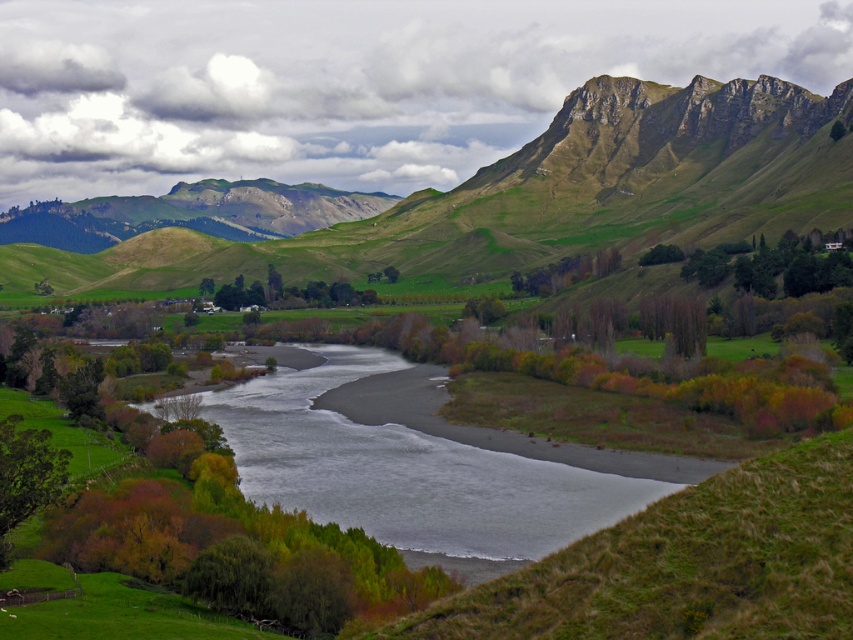
Is gray sand river at center above green leafy tree at center?

Correct, gray sand river at center is located above green leafy tree at center.

Can you confirm if gray sand river at center is positioned below green leafy tree at center?

Actually, gray sand river at center is above green leafy tree at center.

Find the location of a particular element. The width and height of the screenshot is (853, 640). gray sand river at center is located at coordinates (422, 464).

Find the location of a particular element. The image size is (853, 640). gray sand river at center is located at coordinates point(422,464).

Which is more to the left, green grassy mountain at upper center or green matte tree at center?

green matte tree at center is more to the left.

From the picture: How much distance is there between green grassy mountain at upper center and green matte tree at center?

green grassy mountain at upper center is 67.65 meters away from green matte tree at center.

Between point (618, 220) and point (337, 305), which one is positioned behind?

The point (618, 220) is behind.

What are the coordinates of `green grassy mountain at upper center` in the screenshot? It's located at (544, 195).

Can you confirm if green leafy tree at center is positioned below green matte tree at center?

Yes.

Does point (148, 509) come closer to viewer compared to point (332, 301)?

Yes, it is in front of point (332, 301).

You are a GUI agent. You are given a task and a screenshot of the screen. Output one action in this format:
    pyautogui.click(x=<x>, y=<y>)
    Task: Click on the green leafy tree at center
    The height and width of the screenshot is (640, 853).
    Given the screenshot: What is the action you would take?
    pyautogui.click(x=241, y=554)